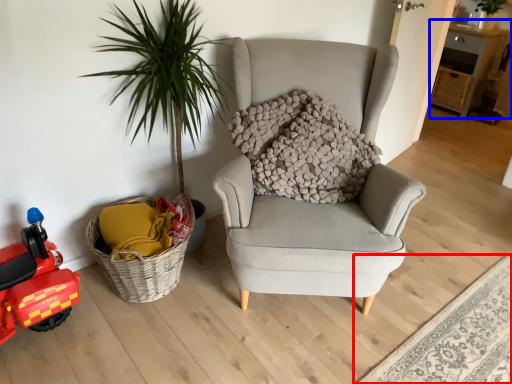
Question: Among these objects, which one is nearest to the camera, plain (highlighted by a red box) or table (highlighted by a blue box)?

Choices:
 (A) plain
 (B) table

Answer: (A)